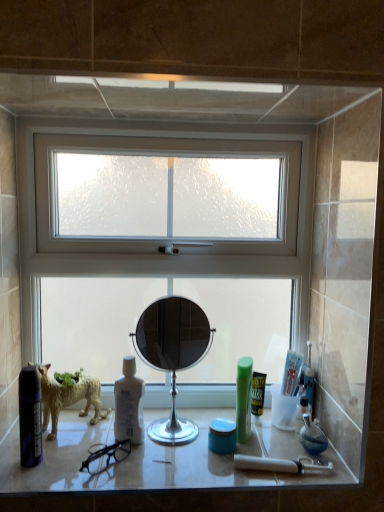
Locate an element on the screen. vacant space behind blue matte jar at center, the second mouthwash positioned from the left is located at coordinates (198, 415).